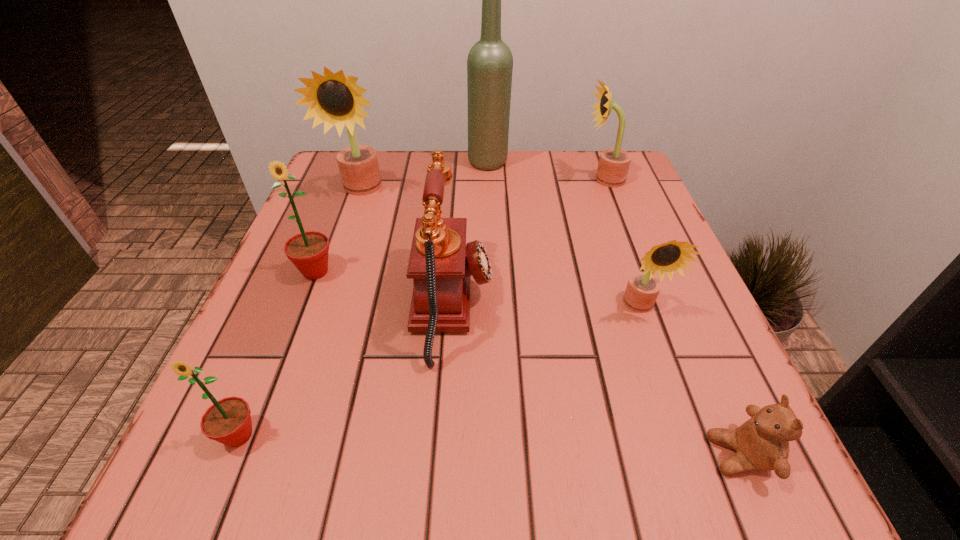
This screenshot has height=540, width=960. Find the location of `object that is the closest to the second smallest yellow sunflower`. object that is the closest to the second smallest yellow sunflower is located at coordinates (490, 62).

Identify which object is located as the sixth nearest to the nearest sunflower. Please provide its 2D coordinates. Your answer should be formatted as a tuple, i.e. [(x, y)], where the tuple contains the x and y coordinates of a point satisfying the conditions above.

[(490, 62)]

Locate an element on the screen. The width and height of the screenshot is (960, 540). the third closest sunflower to the second nearest sunflower is located at coordinates (335, 99).

Locate which sunflower is the third closest to the shortest object. Please provide its 2D coordinates. Your answer should be formatted as a tuple, i.e. [(x, y)], where the tuple contains the x and y coordinates of a point satisfying the conditions above.

[(228, 421)]

Identify which yellow sunflower is the nearest to the shortest object. Please provide its 2D coordinates. Your answer should be formatted as a tuple, i.e. [(x, y)], where the tuple contains the x and y coordinates of a point satisfying the conditions above.

[(642, 290)]

I want to click on yellow sunflower that is the third nearest to the teddy bear, so click(335, 99).

The width and height of the screenshot is (960, 540). What are the coordinates of `free space that satisfies the following two spatial constraints: 1. on the face of the second smallest yellow sunflower; 2. on the face of the farther green sunflower` in the screenshot? It's located at (638, 272).